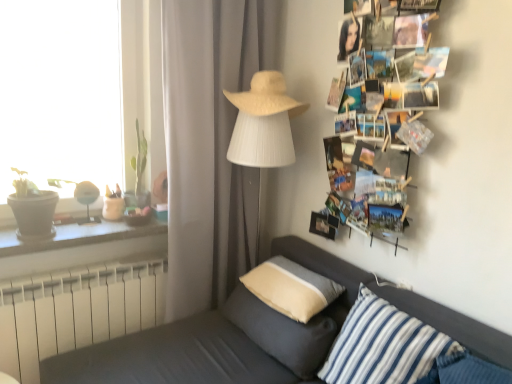
Where is `empty space that is ontop of dark gray concrete window sill at left (from a real-world perspective)`? The image size is (512, 384). empty space that is ontop of dark gray concrete window sill at left (from a real-world perspective) is located at coordinates (83, 229).